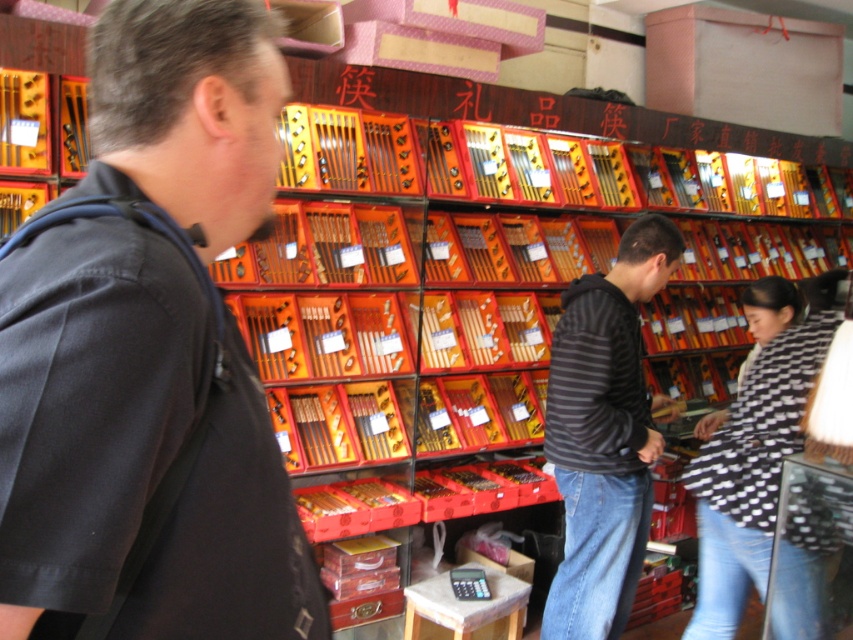
Which is below, black matte shirt at left or black and white checkered shirt at lower right?

black and white checkered shirt at lower right

Can you confirm if black matte shirt at left is positioned above black and white checkered shirt at lower right?

Yes, black matte shirt at left is above black and white checkered shirt at lower right.

Is point (260, 22) less distant than point (720, 579)?

Yes, it is.

Image resolution: width=853 pixels, height=640 pixels. I want to click on black matte shirt at left, so click(x=149, y=353).

Based on the photo, is striped hoodie at center behind black and white checkered shirt at lower right?

Yes.

Where is `striped hoodie at center`? The height and width of the screenshot is (640, 853). striped hoodie at center is located at coordinates (604, 435).

The height and width of the screenshot is (640, 853). Find the location of `striped hoodie at center`. striped hoodie at center is located at coordinates (604, 435).

Is black matte shirt at left positioned in front of striped hoodie at center?

Yes, it is.

The height and width of the screenshot is (640, 853). I want to click on black matte shirt at left, so click(x=149, y=353).

Locate an element on the screen. Image resolution: width=853 pixels, height=640 pixels. black matte shirt at left is located at coordinates (149, 353).